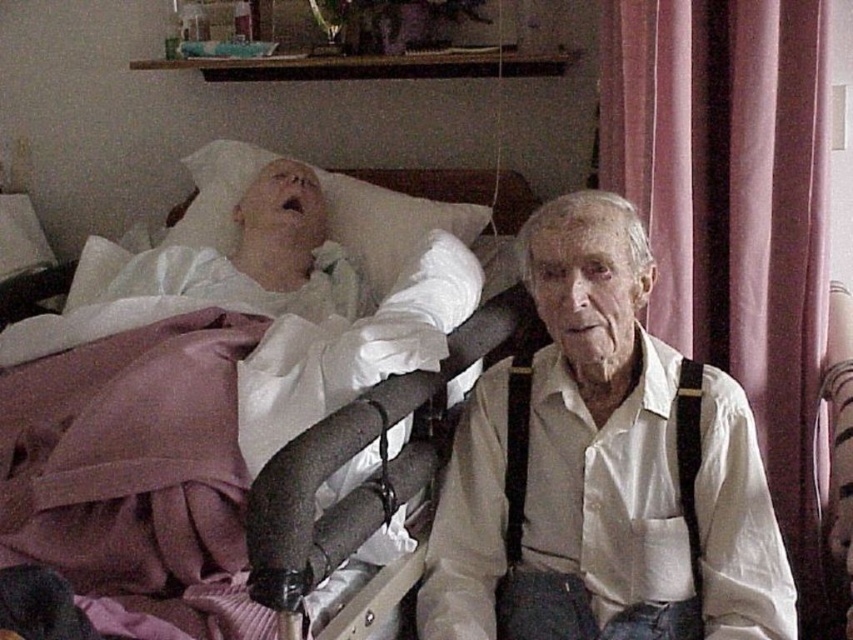
Question: Based on their relative distances, which object is farther from the black fabric suspenders at right?

Choices:
 (A) white fabric at upper left
 (B) white soft pillow at upper left
 (C) white cotton shirt at center
 (D) white fabric bed at upper left

Answer: (A)

Question: Which of the following is the farthest from the observer?

Choices:
 (A) (670, 285)
 (B) (279, 160)
 (C) (770, 579)
 (D) (36, 317)

Answer: (B)

Question: Considering the real-world distances, which object is farthest from the white cotton shirt at center?

Choices:
 (A) white fabric bed at upper left
 (B) black fabric suspenders at right

Answer: (A)

Question: Does white fabric bed at upper left appear on the right side of black fabric suspenders at right?

Choices:
 (A) yes
 (B) no

Answer: (B)

Question: Is white cotton shirt at center positioned behind pink fabric curtain at right?

Choices:
 (A) yes
 (B) no

Answer: (B)

Question: Can you confirm if white fabric bed at upper left is positioned above white fabric at upper left?

Choices:
 (A) no
 (B) yes

Answer: (A)